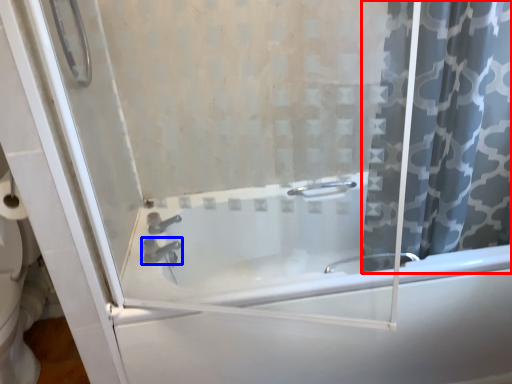
Question: Which object is closer to the camera taking this photo, curtain (highlighted by a red box) or tap (highlighted by a blue box)?

Choices:
 (A) curtain
 (B) tap

Answer: (A)